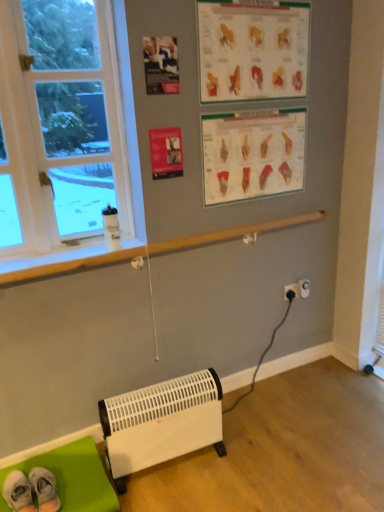
Where is `free space in front of white plastic heater at lower center`? The width and height of the screenshot is (384, 512). free space in front of white plastic heater at lower center is located at coordinates (182, 494).